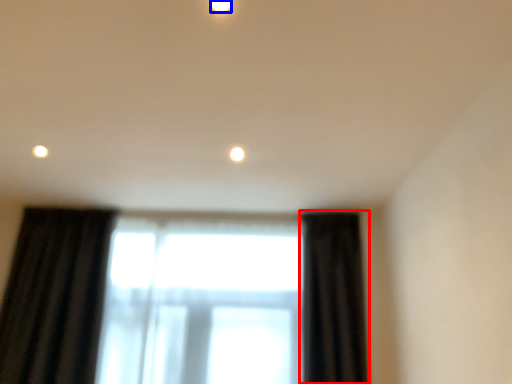
Question: Among these objects, which one is nearest to the camera, curtain (highlighted by a red box) or lighting (highlighted by a blue box)?

Choices:
 (A) curtain
 (B) lighting

Answer: (B)